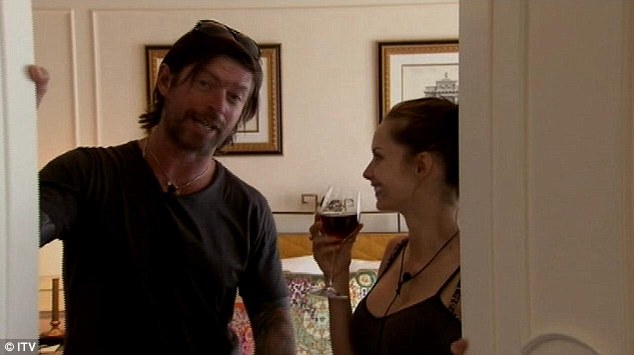
Where is `wall`? wall is located at coordinates (330, 109).